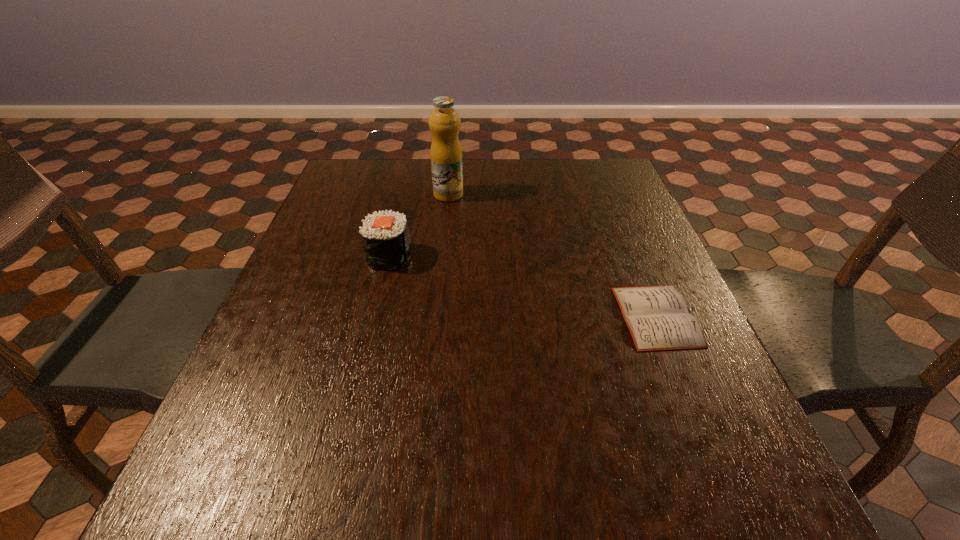
Where is `object that is at the right edge`? Image resolution: width=960 pixels, height=540 pixels. object that is at the right edge is located at coordinates (657, 317).

In the image, there is a desktop. Identify the location of free space at the far edge. This screenshot has height=540, width=960. (501, 166).

This screenshot has height=540, width=960. I want to click on blank space at the near edge, so click(486, 505).

Where is `vacant space at the left edge of the desktop`? The image size is (960, 540). vacant space at the left edge of the desktop is located at coordinates (233, 420).

I want to click on free spot at the far left corner of the desktop, so click(x=339, y=171).

The image size is (960, 540). I want to click on free space at the near left corner of the desktop, so click(286, 486).

You are a GUI agent. You are given a task and a screenshot of the screen. Output one action in this format:
    pyautogui.click(x=<x>, y=<y>)
    Task: Click on the free point at the far right corner
    The image size is (960, 540).
    Given the screenshot: What is the action you would take?
    624,180

Locate an element on the screen. The image size is (960, 540). vacant space that is in between the nearest object and the tallest object is located at coordinates (552, 255).

Where is `free point between the fruit juice and the sushi`? The image size is (960, 540). free point between the fruit juice and the sushi is located at coordinates (419, 225).

Locate an element on the screen. This screenshot has width=960, height=540. free space between the leftmost object and the shortest object is located at coordinates (523, 286).